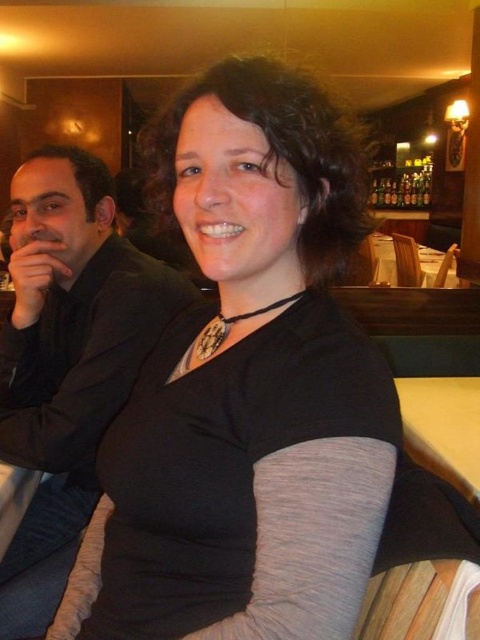
Question: Is black matte suit at left smaller than yellow wood table at center?

Choices:
 (A) no
 (B) yes

Answer: (A)

Question: Does black matte suit at left come behind yellow wood table at center?

Choices:
 (A) no
 (B) yes

Answer: (B)

Question: Which point is closer to the camera?

Choices:
 (A) (431, 456)
 (B) (69, 211)

Answer: (A)

Question: Which point is closer to the camera taking this photo?

Choices:
 (A) (46, 339)
 (B) (434, 445)

Answer: (B)

Question: Is black matte suit at left below yellow wood table at center?

Choices:
 (A) no
 (B) yes

Answer: (A)